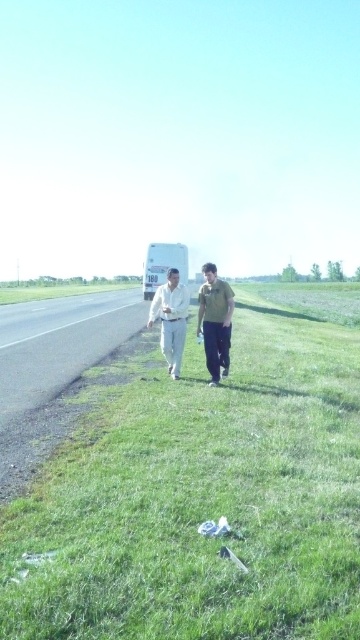
Question: Which of the following is the farthest from the observer?

Choices:
 (A) (159, 275)
 (B) (173, 404)
 (C) (186, 310)

Answer: (A)

Question: Among these points, which one is nearest to the camera?

Choices:
 (A) (155, 262)
 (B) (169, 368)

Answer: (B)

Question: Considering the relative positions of light brown cotton pants at center and white cotton shirt at center in the image provided, where is light brown cotton pants at center located with respect to white cotton shirt at center?

Choices:
 (A) right
 (B) left

Answer: (A)

Question: Where is green grass at center located in relation to asphalt road at left in the image?

Choices:
 (A) right
 (B) left

Answer: (A)

Question: Does green grass at center appear on the left side of light brown cotton pants at center?

Choices:
 (A) no
 (B) yes

Answer: (A)

Question: Considering the real-world distances, which object is farthest from the white matte trailer truck at center?

Choices:
 (A) green fabric jacket at center
 (B) white cotton shirt at center
 (C) asphalt road at left
 (D) green grass at center

Answer: (A)